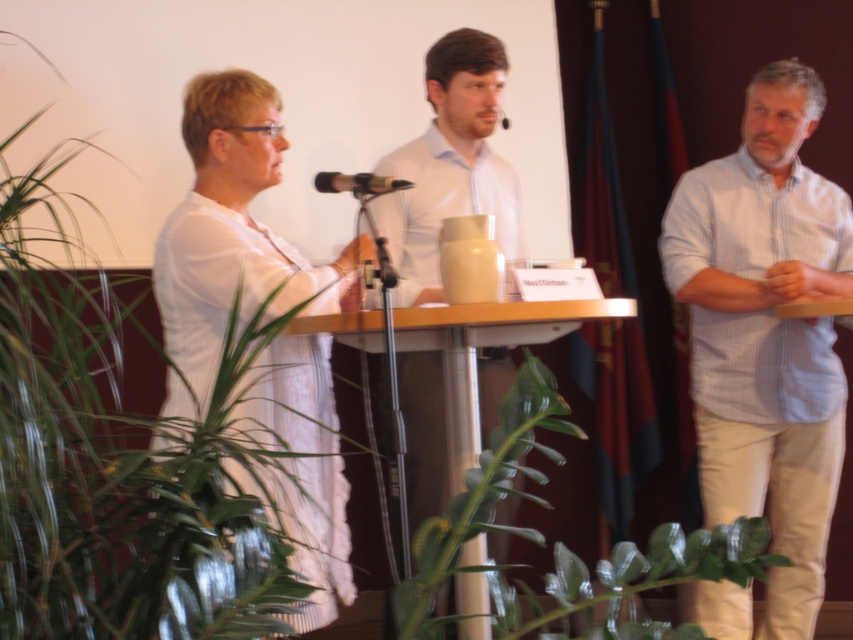
Question: Is black matte microphone at center wider than black plastic microphone at center?

Choices:
 (A) yes
 (B) no

Answer: (A)

Question: Does white striped shirt at right appear under black matte microphone at center?

Choices:
 (A) yes
 (B) no

Answer: (A)

Question: Does black matte microphone at center have a lesser width compared to black plastic microphone at center?

Choices:
 (A) no
 (B) yes

Answer: (A)

Question: Which object is positioned closest to the green glossy leaf at lower center?

Choices:
 (A) black plastic microphone at center
 (B) black matte microphone at center

Answer: (B)

Question: Which object is positioned closest to the green leafy plant at left?

Choices:
 (A) black plastic microphone at center
 (B) black matte microphone at center
 (C) white striped shirt at right
 (D) green glossy leaf at lower center

Answer: (D)

Question: Estimate the real-world distances between objects in this image. Which object is closer to the green leafy plant at left?

Choices:
 (A) green glossy leaf at lower center
 (B) black matte microphone at center

Answer: (A)